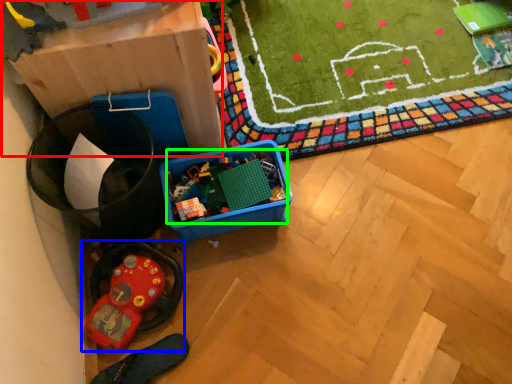
Question: Which object is positioned farthest from cardboard box (highlighted by a red box)? Select from toy (highlighted by a blue box) and toy (highlighted by a green box).

Choices:
 (A) toy
 (B) toy

Answer: (A)